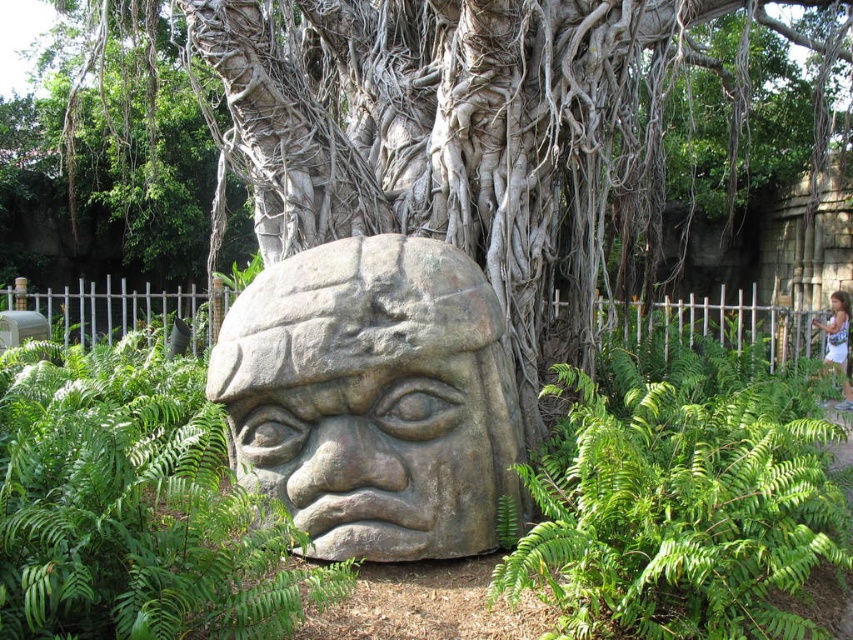
You are an archaeologist examining the gray stone head at center and the green leafy fern at center in the image. Which object takes up more area in the image?

The green leafy fern at center takes up more area than the gray stone head at center.

You are a painter standing at the edge of the scene. You want to paint the gray stone head at center. Where should you position yourself to ensure the point at coordinates point (372, 397) is visible in your painting?

The point at coordinates point (372, 397) is on the gray stone head at center, so you should position yourself facing the gray stone head at center to ensure the point is visible in your painting.